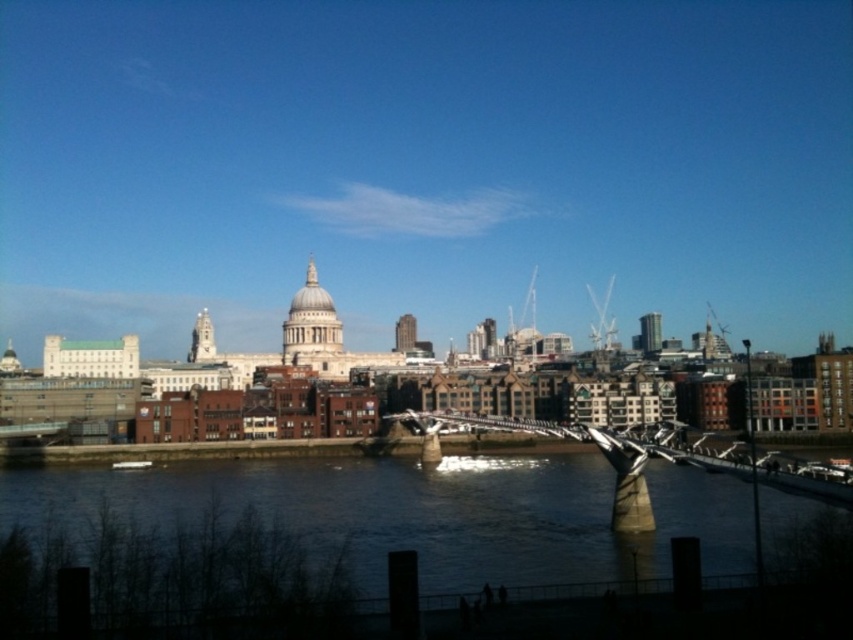
Question: Is dark water at center in front of metallic silver bridge at center?

Choices:
 (A) yes
 (B) no

Answer: (A)

Question: Is dark water at center to the right of metallic silver bridge at center from the viewer's perspective?

Choices:
 (A) no
 (B) yes

Answer: (A)

Question: Does dark water at center appear on the left side of metallic silver bridge at center?

Choices:
 (A) yes
 (B) no

Answer: (A)

Question: Which point is closer to the camera?

Choices:
 (A) metallic silver bridge at center
 (B) dark water at center

Answer: (B)